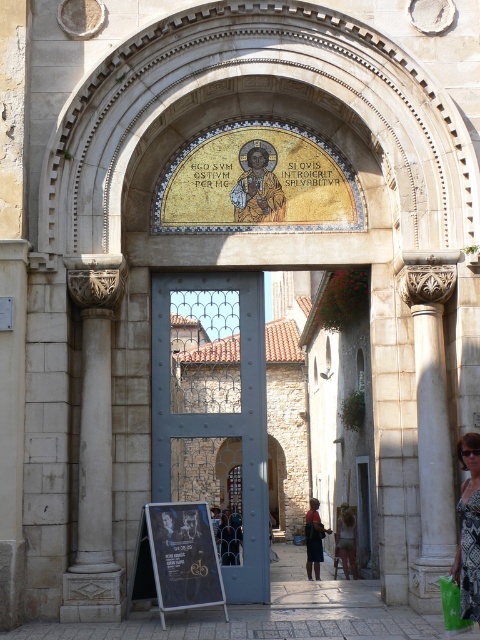
Does patterned fabric dress at center have a smaller size compared to light brown fabric dress at center?

Actually, patterned fabric dress at center might be larger than light brown fabric dress at center.

Who is taller, patterned fabric dress at center or light brown fabric dress at center?

patterned fabric dress at center

Does point (478, 536) lie behind point (336, 540)?

No, it is not.

The image size is (480, 640). Find the location of `patterned fabric dress at center`. patterned fabric dress at center is located at coordinates (468, 529).

Does point (259, 573) come closer to viewer compared to point (264, 148)?

Yes, point (259, 573) is in front of point (264, 148).

Find the location of a particular element. This screenshot has height=640, width=480. blue metallic door at center is located at coordinates (214, 410).

At what (x,y) coordinates should I click in order to perform the action: click on blue metallic door at center. Please return your answer as a coordinate pair (x, y). The height and width of the screenshot is (640, 480). Looking at the image, I should click on (214, 410).

Locate an element on the screen. This screenshot has height=640, width=480. blue metallic door at center is located at coordinates (214, 410).

Measure the distance between light brown fabric dress at center and camera.

light brown fabric dress at center and camera are 283.56 feet apart from each other.

Describe the element at coordinates (347, 540) in the screenshot. I see `light brown fabric dress at center` at that location.

Which is in front, point (344, 548) or point (451, 605)?

Point (451, 605) is in front.

You are a GUI agent. You are given a task and a screenshot of the screen. Output one action in this format:
    pyautogui.click(x=<x>, y=<y>)
    Task: Click on the light brown fabric dress at center
    Image resolution: width=480 pixels, height=640 pixels.
    Given the screenshot: What is the action you would take?
    pyautogui.click(x=347, y=540)